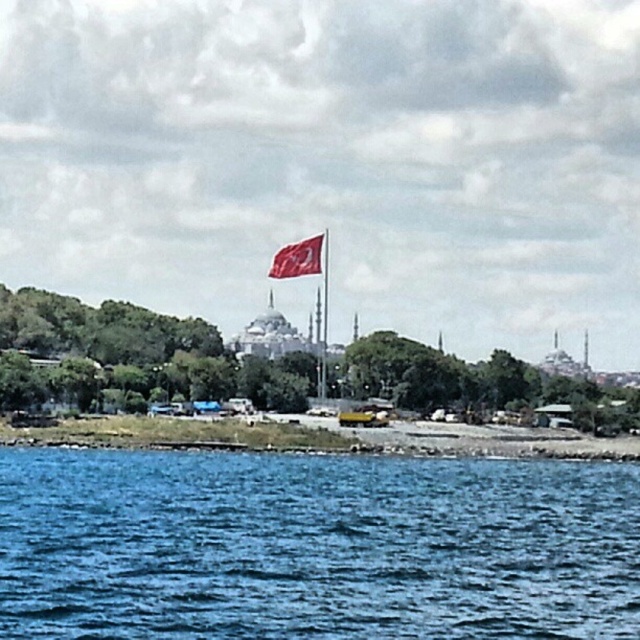
You are a photographer aiming to capture the reflection of the red fabric flag at center in the blue liquid water at lower center. Based on the scene description, can you confirm if the positioning allows the flag to be reflected in the water?

The blue liquid water at lower center is to the right of the red fabric flag at center. Since reflections in water typically mirror objects above them, the flag would need to be positioned above the water to cast its reflection. However, the flag is at the center while the water is at the lower center. This suggests the flag is not directly above the water, so its reflection might not be visible in the water.

You are a photographer trying to capture the entire scene in one shot. Considering the blue liquid water at lower center and the red fabric flag at center, which object should you focus on first to ensure both are in frame?

The blue liquid water at lower center has a larger size compared to the red fabric flag at center, so you should focus on the blue liquid water at lower center first to ensure both are in frame.